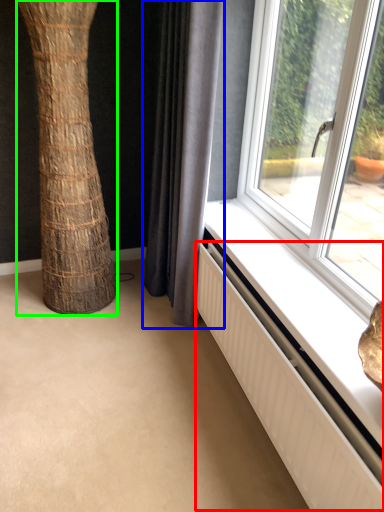
Question: Which object is positioned closest to radiator (highlighted by a red box)? Select from curtain (highlighted by a blue box) and tree trunk (highlighted by a green box).

Choices:
 (A) curtain
 (B) tree trunk

Answer: (A)